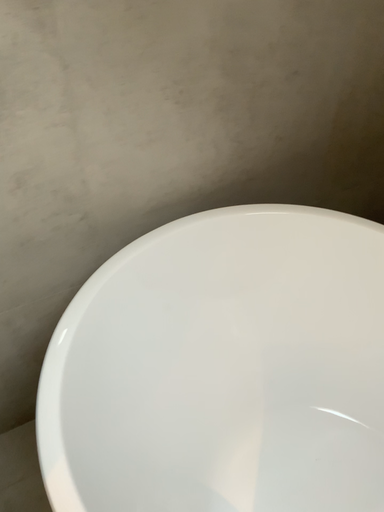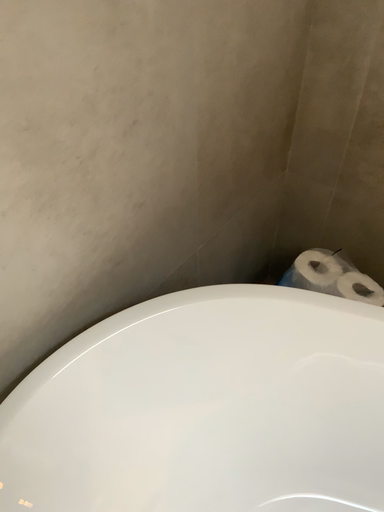
Question: Which way did the camera rotate in the video?

Choices:
 (A) rotated right
 (B) rotated left

Answer: (A)